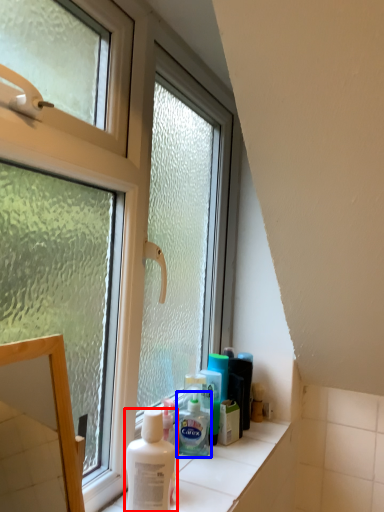
Question: Which point is closer to the camera, shaving cream (highlighted by a red box) or shaving cream (highlighted by a blue box)?

Choices:
 (A) shaving cream
 (B) shaving cream

Answer: (A)